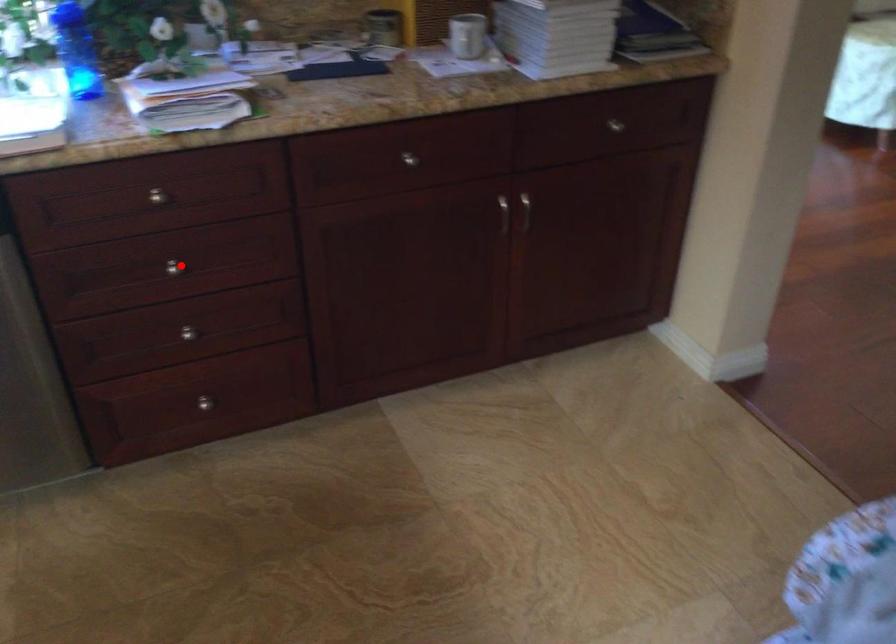
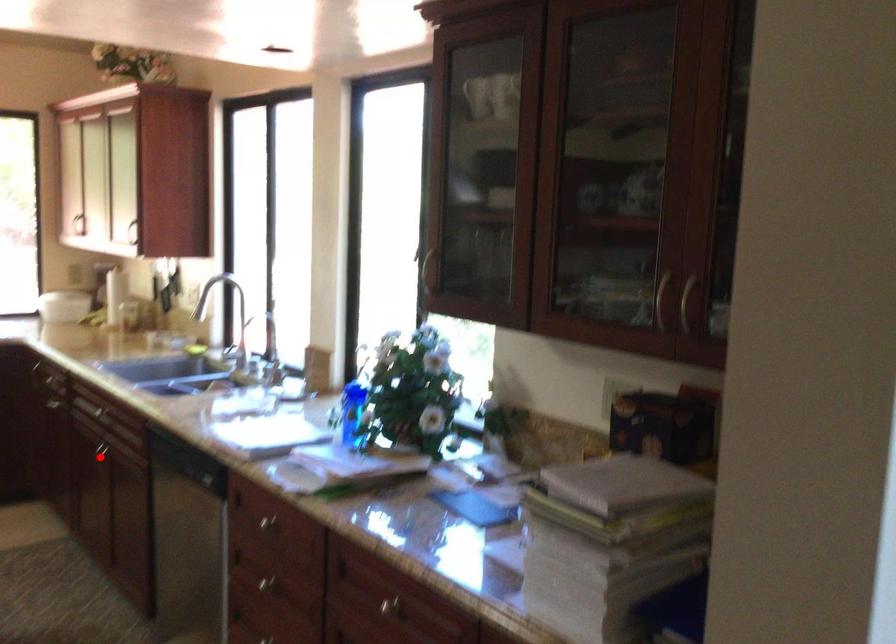
I am providing you with two images of the same scene from different viewpoints. A red point is marked on the first image and another point is marked on the second image. Is the marked point in image1 the same physical position as the marked point in image2?

No